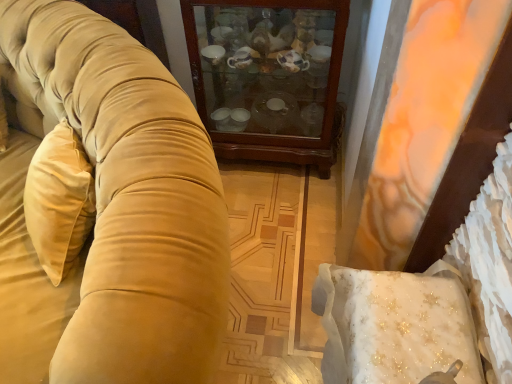
Question: Considering the relative sizes of wooden cabinet at center and velvet gold couch at left in the image provided, is wooden cabinet at center bigger than velvet gold couch at left?

Choices:
 (A) no
 (B) yes

Answer: (A)

Question: From a real-world perspective, is wooden cabinet at center on velvet gold couch at left?

Choices:
 (A) no
 (B) yes

Answer: (A)

Question: Is wooden cabinet at center oriented away from velvet gold couch at left?

Choices:
 (A) no
 (B) yes

Answer: (A)

Question: Is wooden cabinet at center touching velvet gold couch at left?

Choices:
 (A) yes
 (B) no

Answer: (B)

Question: Is wooden cabinet at center thinner than velvet gold couch at left?

Choices:
 (A) no
 (B) yes

Answer: (B)

Question: Would you say velvet gold couch at left is part of wooden cabinet at center's contents?

Choices:
 (A) no
 (B) yes

Answer: (A)

Question: From the image's perspective, is velvet gold couch at left beneath wooden cabinet at center?

Choices:
 (A) no
 (B) yes

Answer: (B)

Question: Does velvet gold couch at left turn towards wooden cabinet at center?

Choices:
 (A) no
 (B) yes

Answer: (A)

Question: Could wooden cabinet at center be considered to be inside velvet gold couch at left?

Choices:
 (A) yes
 (B) no

Answer: (B)

Question: Is velvet gold couch at left oriented away from wooden cabinet at center?

Choices:
 (A) yes
 (B) no

Answer: (A)

Question: Is velvet gold couch at left placed right next to wooden cabinet at center?

Choices:
 (A) yes
 (B) no

Answer: (B)

Question: Can you confirm if velvet gold couch at left is shorter than wooden cabinet at center?

Choices:
 (A) yes
 (B) no

Answer: (B)

Question: From a real-world perspective, is velvet gold couch at left physically located above or below wooden cabinet at center?

Choices:
 (A) above
 (B) below

Answer: (A)